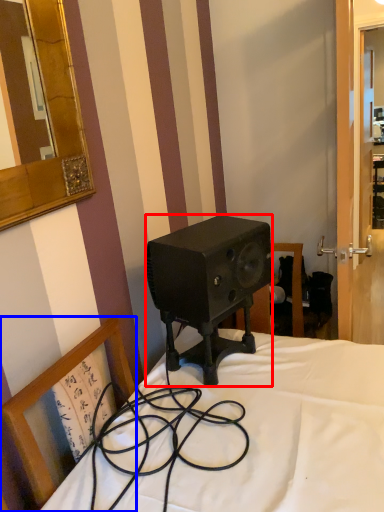
Question: Which object is further to the camera taking this photo, speaker (highlighted by a red box) or chair (highlighted by a blue box)?

Choices:
 (A) speaker
 (B) chair

Answer: (A)